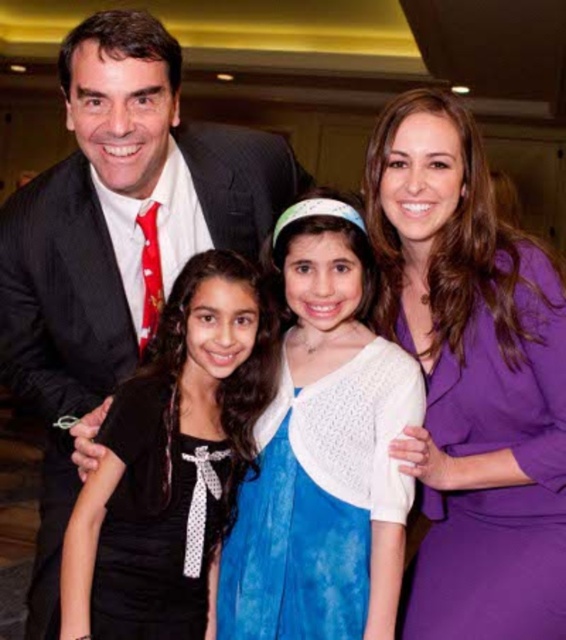
You are standing in the room where the family is posing for a photo. You want to take a closer look at the purple satin dress at right without moving closer. Can you see the dress clearly from your current position?

The purple satin dress at right is 4.40 feet away from the viewer, so yes, you can see it clearly from this distance.